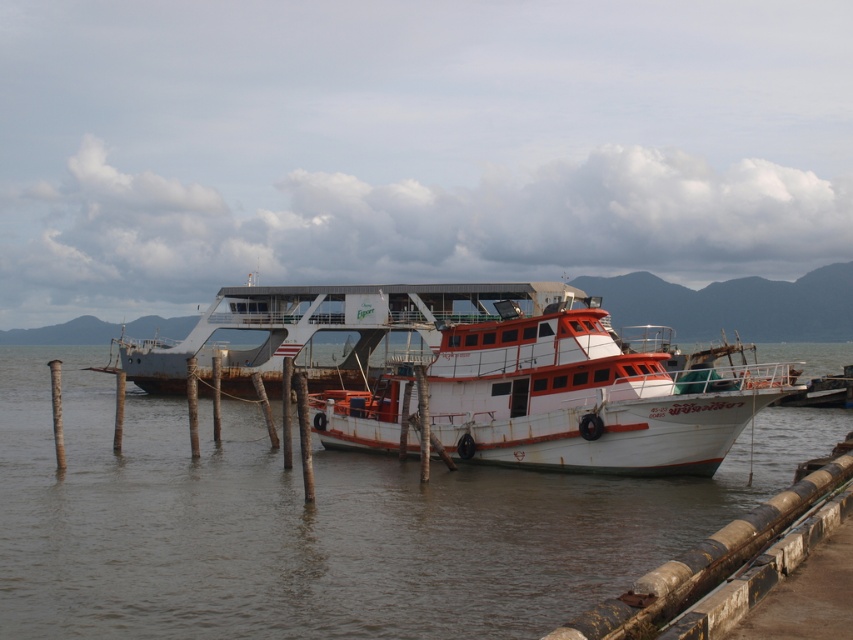
You are a photographer planning to capture the white matte boat at center and the rusty metallic water at center in a single frame. Given that your camera has a limited field of view, which object should you prioritize framing first to ensure both are visible?

Since the rusty metallic water at center is larger in size than the white matte boat at center, you should prioritize framing the larger rusty metallic water at center first to ensure both objects fit within the camera frame.

You are a tour guide planning to walk from the rusty metallic water at center to the rusty metal ferry at center. Given that your average walking speed is 3 feet per second, how many seconds will it take you to reach the ferry?

The distance between the rusty metallic water at center and the rusty metal ferry at center is 38.82 feet. At a walking speed of 3 feet per second, it would take approximately 12.94 seconds to reach the ferry.

You are a tourist standing on the pier and want to take a photo of both the white matte boat at center and the rusty metal ferry at center. Which boat should you stand closer to in order to include both in your camera frame without zooming?

You should stand closer to the rusty metal ferry at center because the white matte boat at center is positioned on the right side of it, so keeping the ferry closer to the camera will help include both boats in the frame without zooming.